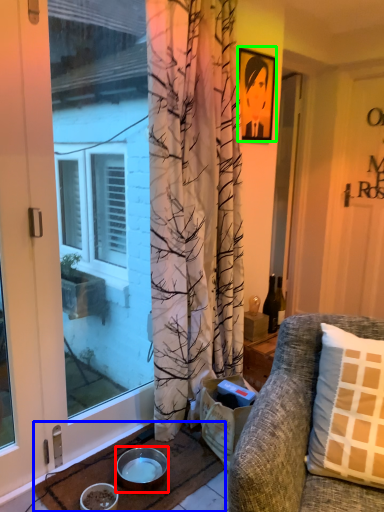
Question: Which object is the farthest from bowl (highlighted by a red box)? Choose among these: doormat (highlighted by a blue box) or picture frame (highlighted by a green box).

Choices:
 (A) doormat
 (B) picture frame

Answer: (B)